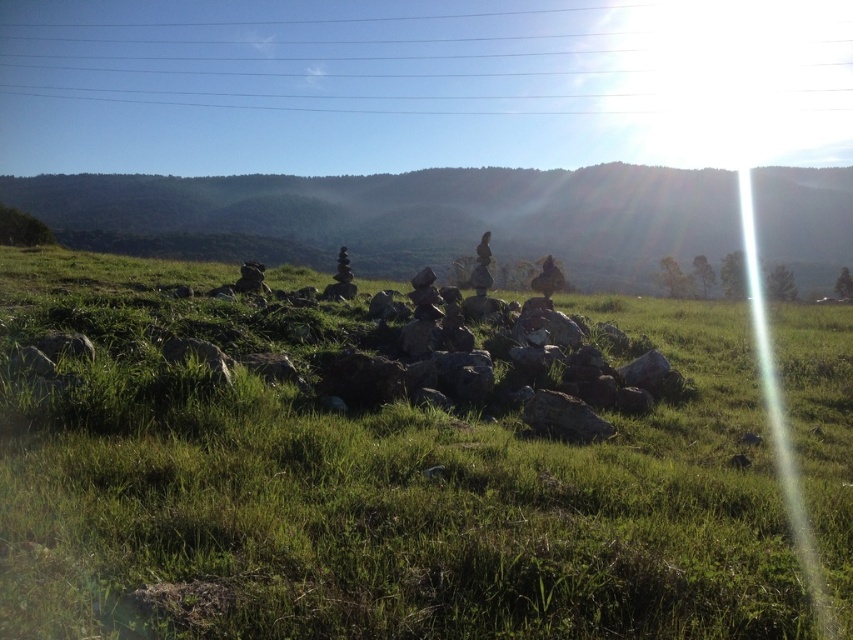
Can you confirm if green grassy at center is taller than metallic wire at upper center?

In fact, green grassy at center may be shorter than metallic wire at upper center.

Consider the image. Does green grassy at center appear on the left side of metallic wire at upper center?

Indeed, green grassy at center is positioned on the left side of metallic wire at upper center.

Is point (682, 440) closer to viewer compared to point (82, 56)?

That is True.

Locate an element on the screen. This screenshot has width=853, height=640. green grassy at center is located at coordinates (368, 472).

Is green grassy at center taller than green grassy hillside at center?

A: No.

Does green grassy at center appear on the right side of green grassy hillside at center?

Yes, green grassy at center is to the right of green grassy hillside at center.

What do you see at coordinates (368, 472) in the screenshot? I see `green grassy at center` at bounding box center [368, 472].

This screenshot has width=853, height=640. In order to click on green grassy at center in this screenshot , I will do `click(368, 472)`.

At what (x,y) coordinates should I click in order to perform the action: click on green grassy hillside at center. Please return your answer as a coordinate pair (x, y). Image resolution: width=853 pixels, height=640 pixels. Looking at the image, I should click on (405, 216).